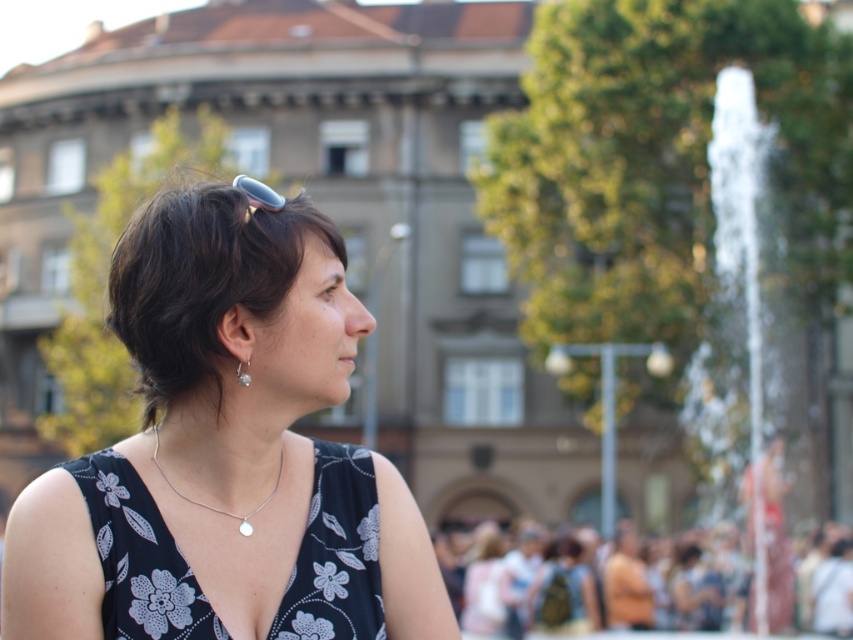
You are a fashion designer observing the scene. You need to determine which object has a greater width between the black floral dress at center and the silver metallic earring at lower left. According to the scene, which one is wider?

The black floral dress at center is wider than the silver metallic earring at lower left.

You are a photographer standing at the camera position. You want to take a closeup shot of the dark brown hair at center. Considering the distance, will you need to use a zoom lens to capture it clearly?

The dark brown hair at center is 27.58 meters away from camera, so you will need to use a zoom lens to capture it clearly at that distance.

You are a photographer standing at the camera position. You want to take a closeup shot of the black floral dress at center. Considering the distance, can you achieve this without moving closer?

The black floral dress at center is 25.93 meters away from the camera, so you would need a telephoto lens to capture a closeup shot without moving closer.